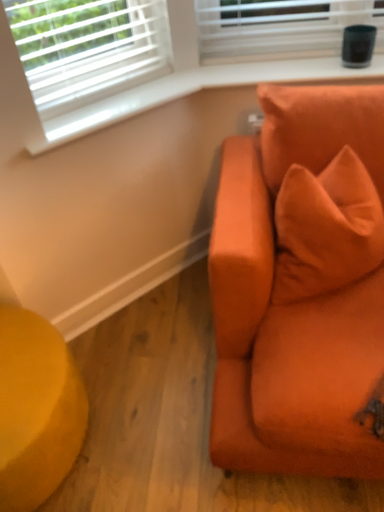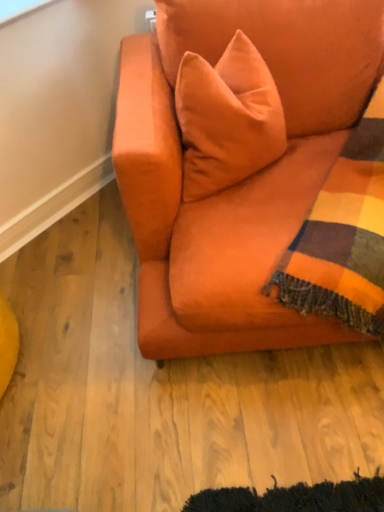
Question: How did the camera likely rotate when shooting the video?

Choices:
 (A) rotated upward
 (B) rotated downward

Answer: (B)